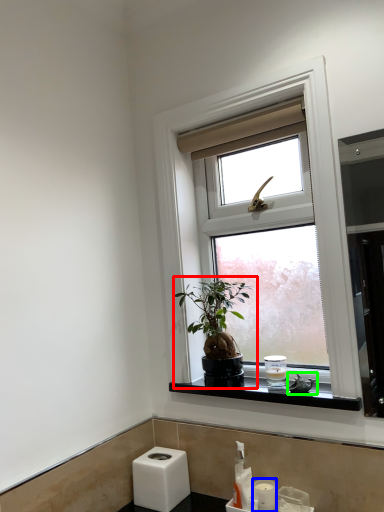
Question: Based on their relative distances, which object is farther from houseplant (highlighted by a red box)? Choose from toiletry (highlighted by a blue box) and bird (highlighted by a green box).

Choices:
 (A) toiletry
 (B) bird

Answer: (A)